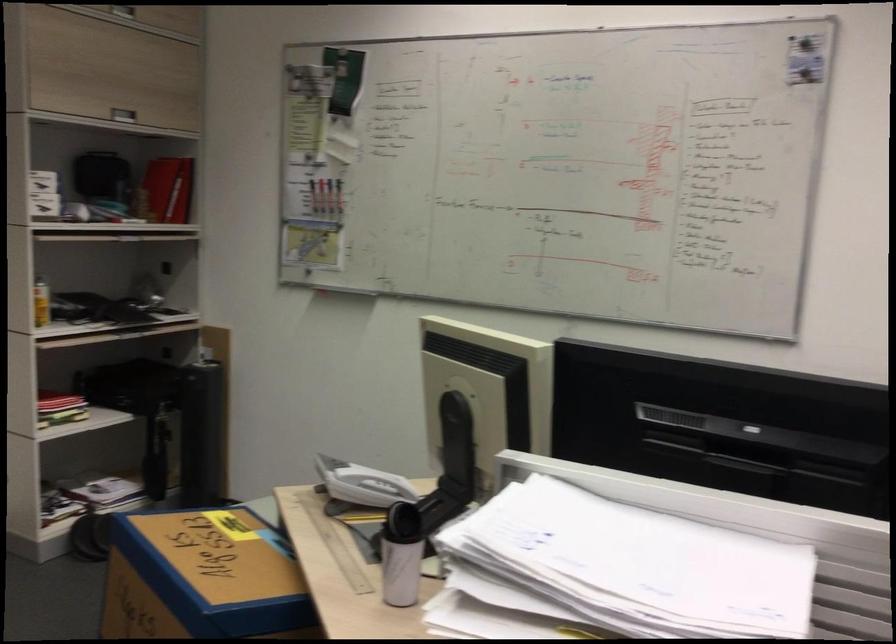
This screenshot has width=896, height=644. I want to click on yellow spray can, so pyautogui.click(x=40, y=303).